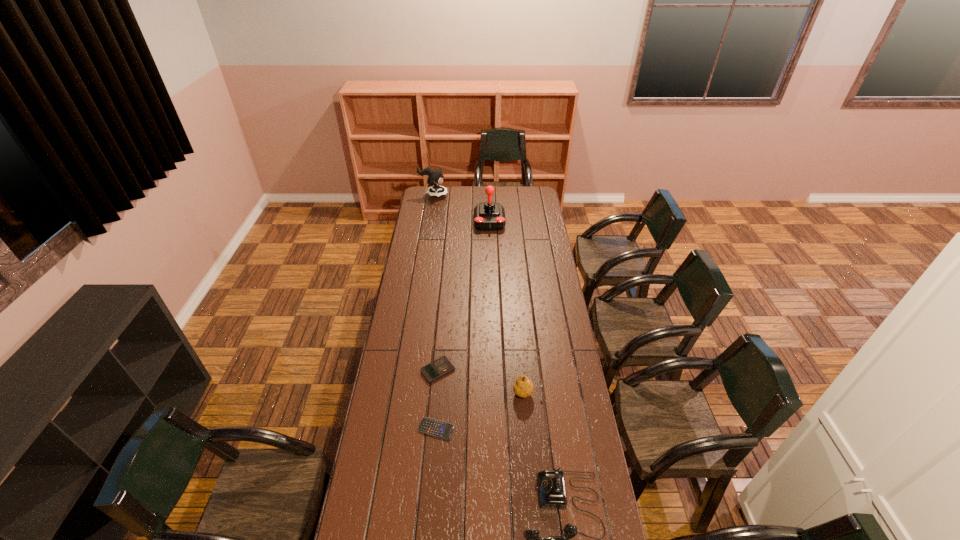
Locate an element on the screen. vacant space located 0.050m on the back of the taller calculator is located at coordinates (440, 348).

Locate an element on the screen. The image size is (960, 540). free spot located on the right of the shortest object is located at coordinates (504, 429).

The height and width of the screenshot is (540, 960). Find the location of `object located at the far edge`. object located at the far edge is located at coordinates (435, 176).

Where is `doll located at the left edge`? The width and height of the screenshot is (960, 540). doll located at the left edge is located at coordinates (435, 176).

This screenshot has width=960, height=540. In order to click on calculator situated at the left edge in this screenshot , I will do `click(442, 366)`.

Find the location of `object that is at the right edge`. object that is at the right edge is located at coordinates pos(523,387).

This screenshot has height=540, width=960. What are the coordinates of `object present at the far left corner` in the screenshot? It's located at (435, 176).

Locate an element on the screen. vacant space at the left edge is located at coordinates (414, 248).

This screenshot has width=960, height=540. Find the location of `vacant space at the right edge of the desktop`. vacant space at the right edge of the desktop is located at coordinates (605, 539).

In the image, there is a desktop. Where is `vacant area at the far left corner`? The image size is (960, 540). vacant area at the far left corner is located at coordinates (443, 197).